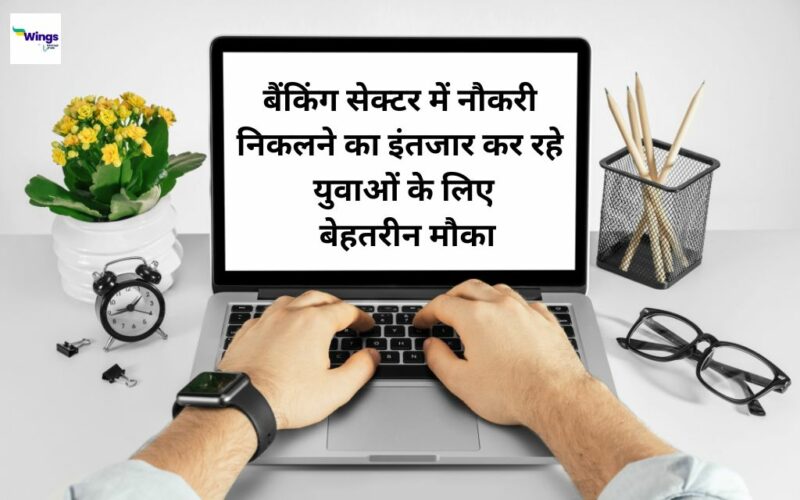
Identify the location of laptop keyboard. (386, 323).